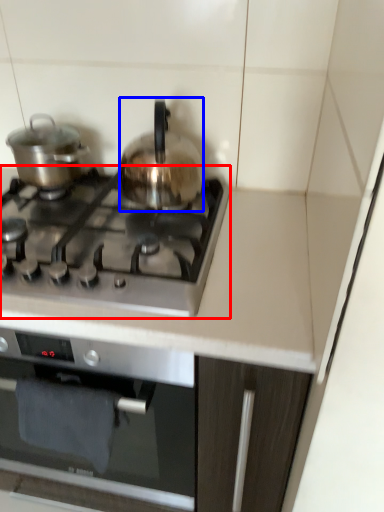
Question: Among these objects, which one is farthest to the camera, gas stove (highlighted by a red box) or kitchen appliance (highlighted by a blue box)?

Choices:
 (A) gas stove
 (B) kitchen appliance

Answer: (B)